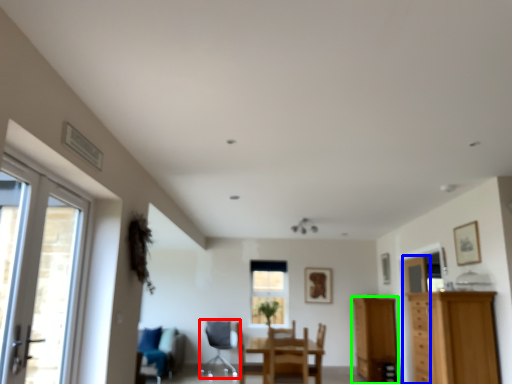
Question: Which object is the closest to the chair (highlighted by a red box)? Choose among these: door (highlighted by a blue box) or cabinetry (highlighted by a green box).

Choices:
 (A) door
 (B) cabinetry

Answer: (B)